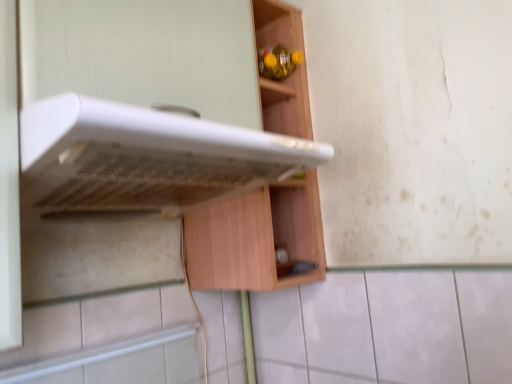
Question: Considering the relative positions of wooden cabinet at center and white plastic oven at upper center in the image provided, is wooden cabinet at center to the left of white plastic oven at upper center from the viewer's perspective?

Choices:
 (A) yes
 (B) no

Answer: (B)

Question: From a real-world perspective, does wooden cabinet at center sit lower than white plastic oven at upper center?

Choices:
 (A) no
 (B) yes

Answer: (A)

Question: Is wooden cabinet at center to the right of white plastic oven at upper center from the viewer's perspective?

Choices:
 (A) no
 (B) yes

Answer: (B)

Question: From the image's perspective, is wooden cabinet at center on top of white plastic oven at upper center?

Choices:
 (A) yes
 (B) no

Answer: (A)

Question: Is wooden cabinet at center oriented away from white plastic oven at upper center?

Choices:
 (A) yes
 (B) no

Answer: (B)

Question: Does wooden cabinet at center contain white plastic oven at upper center?

Choices:
 (A) no
 (B) yes

Answer: (A)

Question: From the image's perspective, would you say white plastic oven at upper center is positioned over wooden cabinet at center?

Choices:
 (A) yes
 (B) no

Answer: (B)

Question: Is white plastic oven at upper center thinner than wooden cabinet at center?

Choices:
 (A) yes
 (B) no

Answer: (B)

Question: Can you confirm if white plastic oven at upper center is shorter than wooden cabinet at center?

Choices:
 (A) no
 (B) yes

Answer: (B)

Question: Is white plastic oven at upper center positioned far away from wooden cabinet at center?

Choices:
 (A) yes
 (B) no

Answer: (B)

Question: Is white plastic oven at upper center wider than wooden cabinet at center?

Choices:
 (A) no
 (B) yes

Answer: (B)

Question: Is white plastic oven at upper center to the left of wooden cabinet at center from the viewer's perspective?

Choices:
 (A) no
 (B) yes

Answer: (B)

Question: From a real-world perspective, relative to wooden cabinet at center, is white plastic oven at upper center vertically above or below?

Choices:
 (A) above
 (B) below

Answer: (B)